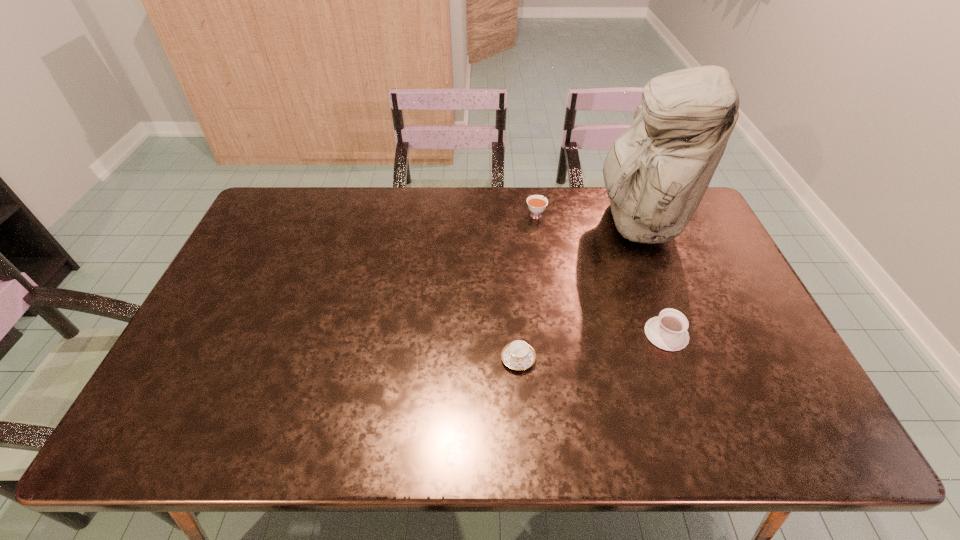
At what (x,y) coordinates should I click in order to perform the action: click on vacant space located on the side of the farthest teacup with the handle. Please return your answer as a coordinate pair (x, y). The image size is (960, 540). Looking at the image, I should click on (533, 195).

Find the location of a particular element. vacant space positioned 0.170m on the handle side of the rightmost teacup is located at coordinates (644, 273).

Find the location of a particular element. free region located on the handle side of the rightmost teacup is located at coordinates (641, 266).

Locate an element on the screen. free space located on the handle side of the rightmost teacup is located at coordinates (653, 298).

Where is `free space located 0.120m on the side with the handle of the leftmost object`? The height and width of the screenshot is (540, 960). free space located 0.120m on the side with the handle of the leftmost object is located at coordinates (522, 420).

This screenshot has width=960, height=540. In order to click on backpack present at the far edge in this screenshot , I will do (x=656, y=173).

Identify the location of teacup at the far edge. (536, 204).

Image resolution: width=960 pixels, height=540 pixels. Identify the location of object that is at the right edge. [x=656, y=173].

This screenshot has height=540, width=960. I want to click on object at the far right corner, so click(x=656, y=173).

In the image, there is a desktop. Find the location of `vacant space at the far edge`. vacant space at the far edge is located at coordinates (505, 189).